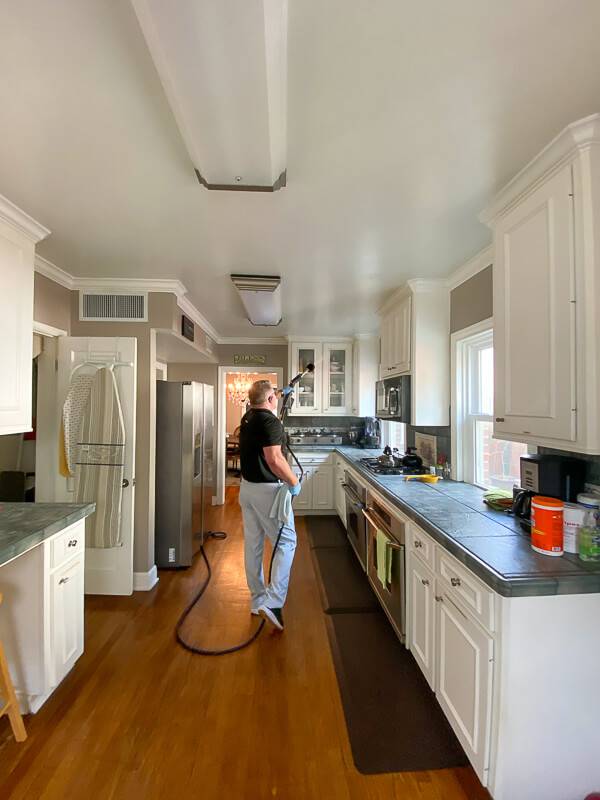
Find the location of a particular element. ceiling light is located at coordinates (259, 312), (239, 124).